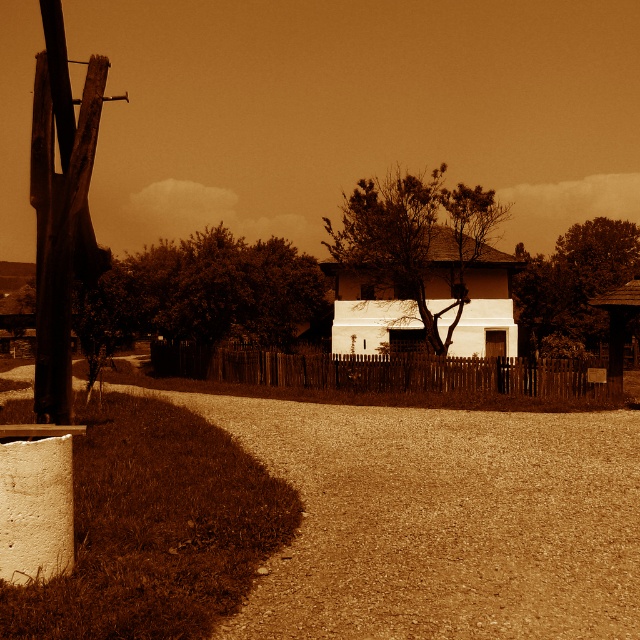
You are an artist planning to paint the scene. You want to ensure the sizes of the smooth white tree at center and the smooth bark tree at center are accurate. Which tree should you draw larger in your painting?

The smooth white tree at center should be drawn larger because it is bigger than the smooth bark tree at center according to the description.

You are standing on the gravel path and looking towards the center of the image. Which tree, the thick textured tree at center or the smooth bark tree at center, is closer to you?

The smooth bark tree at center is closer to you because the thick textured tree at center is positioned above it, indicating it is further away.